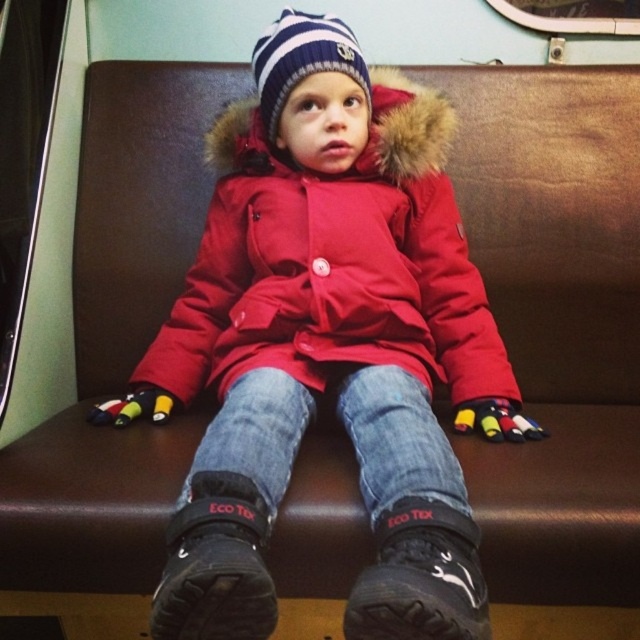
Question: Which of the following is the farthest from the observer?

Choices:
 (A) (275, 90)
 (B) (378, 484)
 (C) (120, 426)

Answer: (A)

Question: Which point appears farthest from the camera in this image?

Choices:
 (A) (198, 244)
 (B) (369, 352)

Answer: (A)

Question: Does red matte jacket at center have a smaller size compared to striped knit hat at center?

Choices:
 (A) no
 (B) yes

Answer: (A)

Question: Is the position of red matte jacket at center more distant than that of jeans at center?

Choices:
 (A) yes
 (B) no

Answer: (A)

Question: Among these points, which one is farthest from the camera?

Choices:
 (A) (262, 204)
 (B) (237, 225)

Answer: (B)

Question: Does matte red coat at center have a smaller size compared to jeans at center?

Choices:
 (A) no
 (B) yes

Answer: (A)